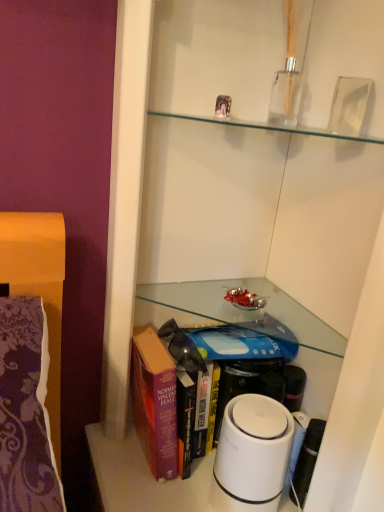
Question: Can you confirm if white plastic humidifier at lower center is wider than purple hardcover book at lower center?

Choices:
 (A) no
 (B) yes

Answer: (A)

Question: Does white plastic humidifier at lower center have a greater height compared to purple hardcover book at lower center?

Choices:
 (A) no
 (B) yes

Answer: (A)

Question: Can you confirm if white plastic humidifier at lower center is smaller than purple hardcover book at lower center?

Choices:
 (A) yes
 (B) no

Answer: (A)

Question: Is the surface of white plastic humidifier at lower center in direct contact with purple hardcover book at lower center?

Choices:
 (A) yes
 (B) no

Answer: (B)

Question: From a real-world perspective, is white plastic humidifier at lower center over purple hardcover book at lower center?

Choices:
 (A) no
 (B) yes

Answer: (A)

Question: Considering the relative sizes of white plastic humidifier at lower center and purple hardcover book at lower center in the image provided, is white plastic humidifier at lower center shorter than purple hardcover book at lower center?

Choices:
 (A) yes
 (B) no

Answer: (A)

Question: Is purple hardcover book at lower center closer to camera compared to white plastic humidifier at lower center?

Choices:
 (A) yes
 (B) no

Answer: (B)

Question: Is purple hardcover book at lower center shorter than white plastic humidifier at lower center?

Choices:
 (A) yes
 (B) no

Answer: (B)

Question: Is purple hardcover book at lower center taller than white plastic humidifier at lower center?

Choices:
 (A) yes
 (B) no

Answer: (A)

Question: Considering the relative sizes of purple hardcover book at lower center and white plastic humidifier at lower center in the image provided, is purple hardcover book at lower center bigger than white plastic humidifier at lower center?

Choices:
 (A) yes
 (B) no

Answer: (A)

Question: Does purple hardcover book at lower center contain white plastic humidifier at lower center?

Choices:
 (A) no
 (B) yes

Answer: (B)

Question: Is white plastic humidifier at lower center at the back of purple hardcover book at lower center?

Choices:
 (A) yes
 (B) no

Answer: (A)

Question: Is purple hardcover book at lower center in front of or behind white plastic humidifier at lower center in the image?

Choices:
 (A) behind
 (B) front

Answer: (A)